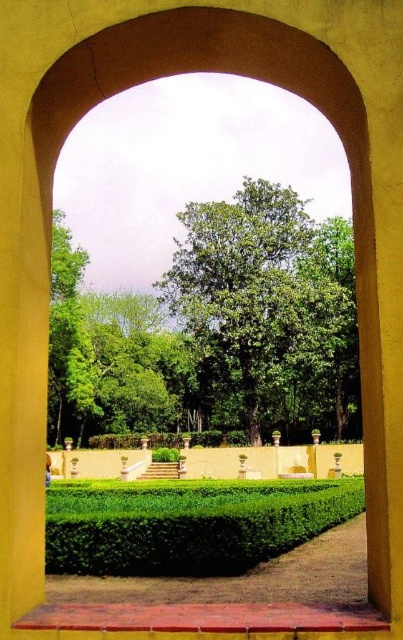
Question: Which point appears farthest from the camera in this image?

Choices:
 (A) [68, 404]
 (B) [276, 548]

Answer: (A)

Question: Is green leafy hedge at center smaller than green leafy tree at left?

Choices:
 (A) yes
 (B) no

Answer: (A)

Question: Can you confirm if green leafy tree at center is wider than green leafy tree at left?

Choices:
 (A) no
 (B) yes

Answer: (B)

Question: Which of these objects is positioned farthest from the green leafy hedge at center?

Choices:
 (A) green leafy tree at center
 (B) green leafy tree at left

Answer: (A)

Question: Can you confirm if green leafy hedge at center is positioned above green leafy tree at left?

Choices:
 (A) yes
 (B) no

Answer: (B)

Question: Which of these objects is positioned closest to the green leafy tree at center?

Choices:
 (A) green leafy hedge at center
 (B) green leafy tree at left

Answer: (B)